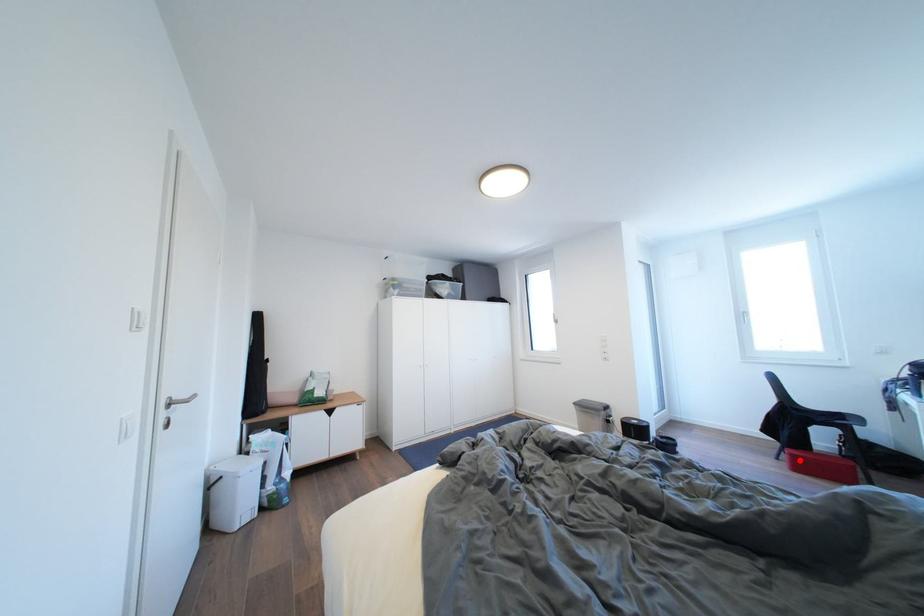
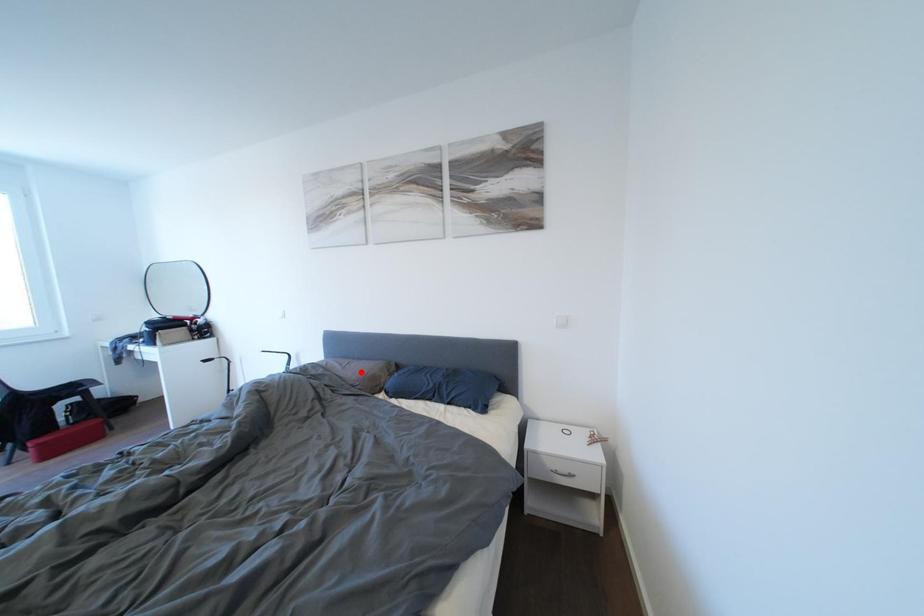
I am providing you with two images of the same scene from different viewpoints. A red point is marked on the first image and another point is marked on the second image. Is the red point in image1 aligned with the point shown in image2?

No